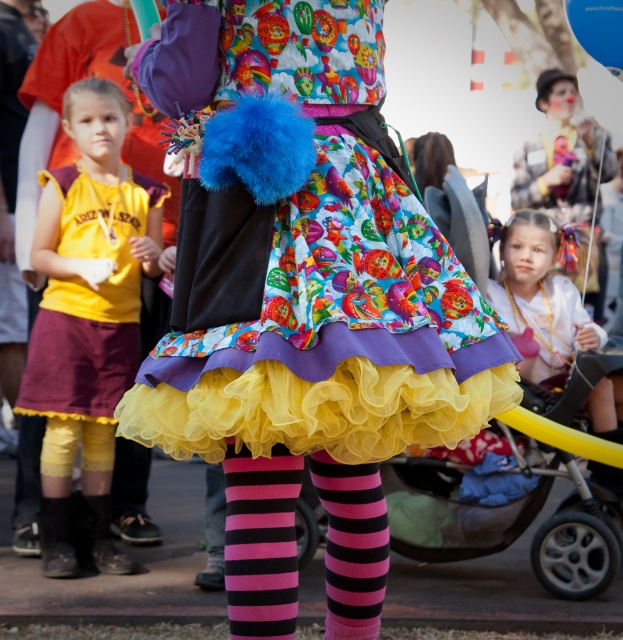
You are a photographer at the event and want to capture both the pastel hairband at upper center and the matte yellow dress at center in a single shot. Which object should you focus on first to ensure both are in focus?

You should focus on the pastel hairband at upper center first because it is closer to the viewer than the matte yellow dress at center. By focusing on the closer object, the depth of field may allow both to be in focus.

You are standing in front of the person at the festive outdoor event. You notice two points marked on their outfit. The first point is at coordinate point(320, 160) and the second is at point(397, 484). Which point is closer to you?

Point(320, 160) is closer to the camera than point(397, 484), so the first point is closer to you.